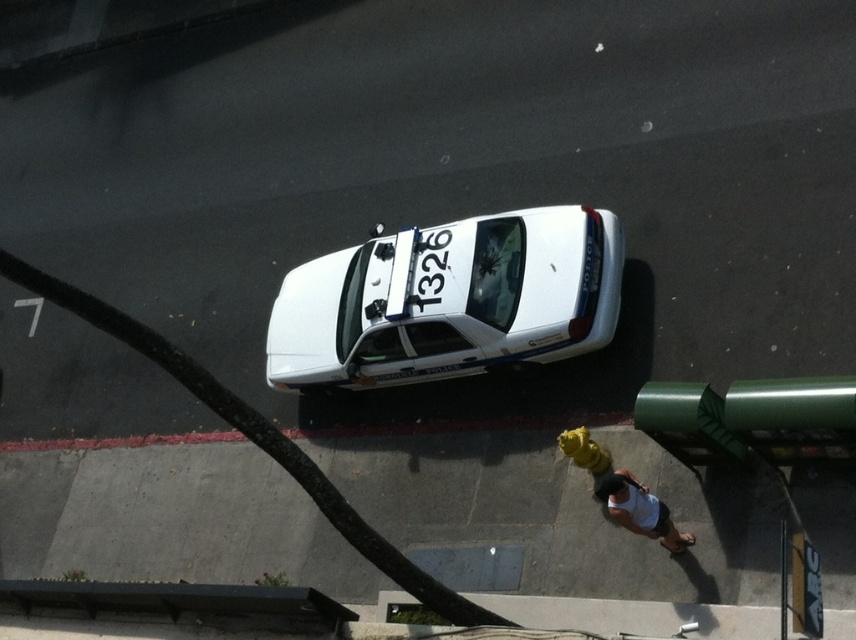
You are a pedestrian standing on the sidewalk. You see the white glossy police car at center and the white tank top at center. Which object is closer to you?

The white tank top at center is closer to you because the white glossy police car at center is located above it.

You are standing at the point closer to the camera between the two points labeled point (456, 268) and point (489, 268). Which point are you at?

You are at point (456, 268) because it is closer to the viewer compared to point (489, 268).

In the scene shown: You are standing at the point marked by the coordinates point (496, 272). Looking around, you see a white police car parked near the curb and a yellow fire hydrant to its right. Which object are you closest to?

The point (496, 272) is on the shiny black car at center, so you are closest to the shiny black car at center.